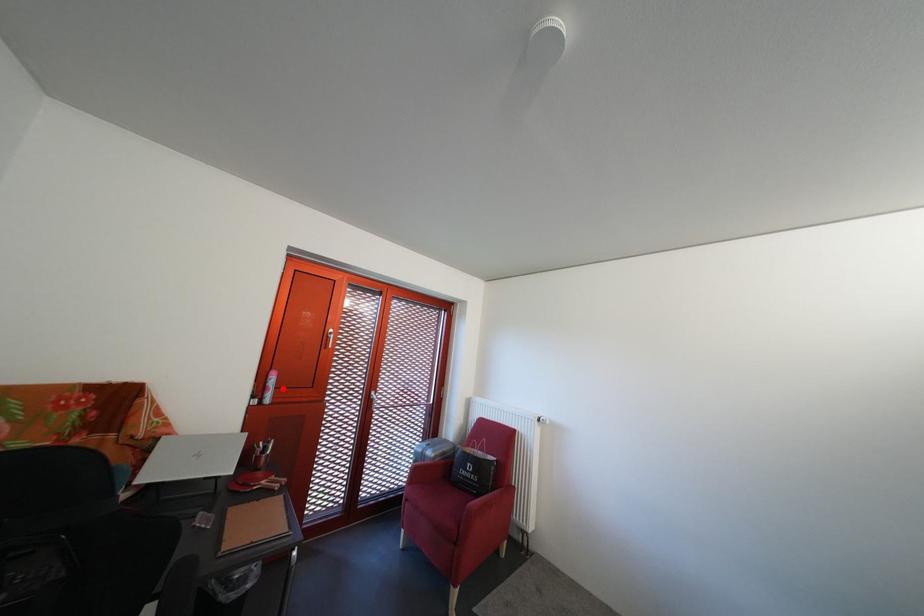
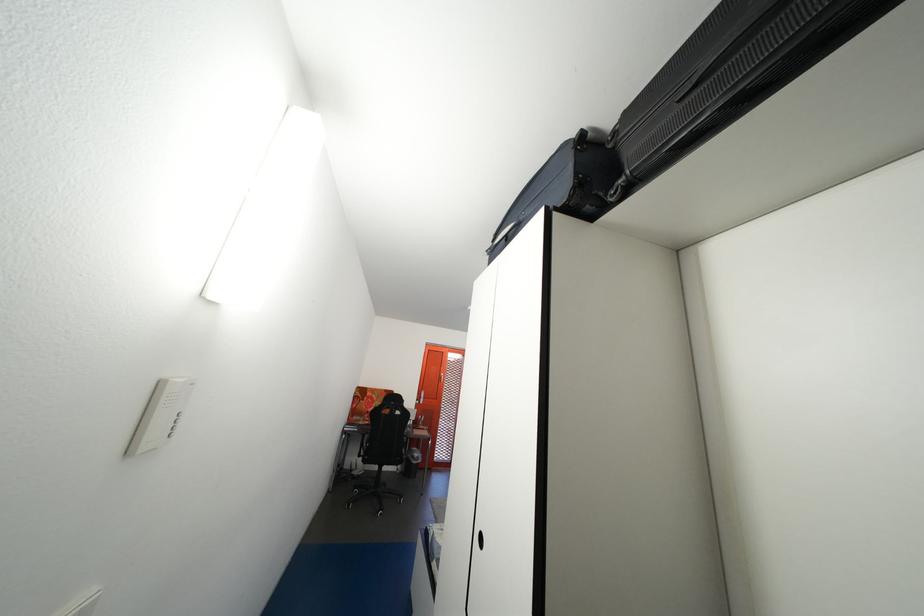
Find the pixel in the second image that matches the highlighted location in the first image.

(433, 402)